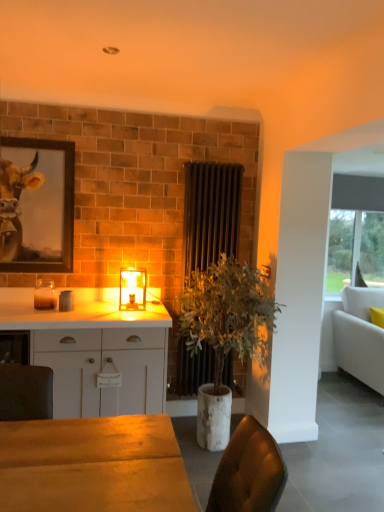
Question: From the image's perspective, would you say white matte cabinet at center is positioned over translucent glass candle at left?

Choices:
 (A) yes
 (B) no

Answer: (B)

Question: Is white matte cabinet at center located outside translucent glass candle at left?

Choices:
 (A) no
 (B) yes

Answer: (B)

Question: Is white matte cabinet at center positioned behind translucent glass candle at left?

Choices:
 (A) yes
 (B) no

Answer: (B)

Question: From the image's perspective, is white matte cabinet at center beneath translucent glass candle at left?

Choices:
 (A) no
 (B) yes

Answer: (B)

Question: Is white matte cabinet at center at the right side of translucent glass candle at left?

Choices:
 (A) no
 (B) yes

Answer: (B)

Question: Can you confirm if white matte cabinet at center is wider than translucent glass candle at left?

Choices:
 (A) no
 (B) yes

Answer: (B)

Question: Are black metal radiator at center and white fabric couch at right far apart?

Choices:
 (A) yes
 (B) no

Answer: (A)

Question: Considering the relative positions of black metal radiator at center and white fabric couch at right in the image provided, is black metal radiator at center to the left of white fabric couch at right from the viewer's perspective?

Choices:
 (A) no
 (B) yes

Answer: (B)

Question: Considering the relative sizes of black metal radiator at center and white fabric couch at right in the image provided, is black metal radiator at center thinner than white fabric couch at right?

Choices:
 (A) no
 (B) yes

Answer: (B)

Question: Is white fabric couch at right surrounded by black metal radiator at center?

Choices:
 (A) no
 (B) yes

Answer: (A)

Question: Is black metal radiator at center facing away from white fabric couch at right?

Choices:
 (A) no
 (B) yes

Answer: (A)

Question: Is black metal radiator at center at the right side of white fabric couch at right?

Choices:
 (A) yes
 (B) no

Answer: (B)

Question: Is translucent glass lamp at center at the right side of wooden framed painting at upper left?

Choices:
 (A) yes
 (B) no

Answer: (A)